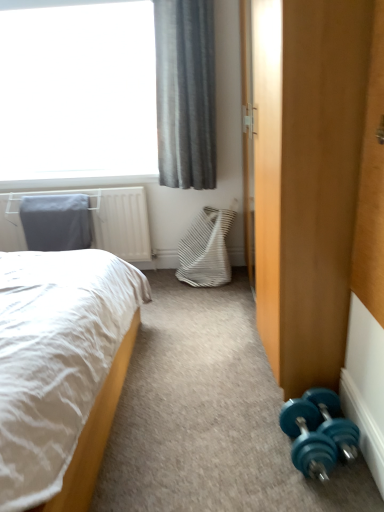
Question: Considering the relative positions of gray fabric curtain at upper left and teal rubber dumbbell at lower right, arranged as the first dumbbell when viewed from the right, in the image provided, is gray fabric curtain at upper left to the right of teal rubber dumbbell at lower right, arranged as the first dumbbell when viewed from the right, from the viewer's perspective?

Choices:
 (A) no
 (B) yes

Answer: (A)

Question: From a real-world perspective, does gray fabric curtain at upper left stand above teal rubber dumbbell at lower right, arranged as the first dumbbell when viewed from the right?

Choices:
 (A) yes
 (B) no

Answer: (A)

Question: From the image's perspective, is gray fabric curtain at upper left above teal rubber dumbbell at lower right, arranged as the first dumbbell when viewed from the right?

Choices:
 (A) yes
 (B) no

Answer: (A)

Question: Does gray fabric curtain at upper left have a smaller size compared to teal rubber dumbbell at lower right, arranged as the first dumbbell when viewed from the right?

Choices:
 (A) no
 (B) yes

Answer: (A)

Question: Considering the relative sizes of gray fabric curtain at upper left and teal rubber dumbbell at lower right, arranged as the first dumbbell when viewed from the right, in the image provided, is gray fabric curtain at upper left thinner than teal rubber dumbbell at lower right, arranged as the first dumbbell when viewed from the right,?

Choices:
 (A) yes
 (B) no

Answer: (B)

Question: From the image's perspective, is gray fabric pillow at upper left located above or below teal rubber dumbbell at lower right, arranged as the first dumbbell when viewed from the right?

Choices:
 (A) below
 (B) above

Answer: (B)

Question: Is gray fabric pillow at upper left taller or shorter than teal rubber dumbbell at lower right, which appears as the second dumbbell when viewed from the left?

Choices:
 (A) tall
 (B) short

Answer: (A)

Question: Do you think gray fabric pillow at upper left is within teal rubber dumbbell at lower right, arranged as the first dumbbell when viewed from the right, or outside of it?

Choices:
 (A) inside
 (B) outside

Answer: (B)

Question: Considering the positions of gray fabric pillow at upper left and teal rubber dumbbell at lower right, arranged as the first dumbbell when viewed from the right, in the image, is gray fabric pillow at upper left bigger or smaller than teal rubber dumbbell at lower right, arranged as the first dumbbell when viewed from the right,?

Choices:
 (A) small
 (B) big

Answer: (B)

Question: In terms of height, does gray fabric pillow at upper left look taller or shorter compared to white soft bed at left?

Choices:
 (A) tall
 (B) short

Answer: (B)

Question: Considering the relative positions of gray fabric pillow at upper left and white soft bed at left in the image provided, is gray fabric pillow at upper left to the left or to the right of white soft bed at left?

Choices:
 (A) right
 (B) left

Answer: (B)

Question: Considering the positions of gray fabric pillow at upper left and white soft bed at left in the image, is gray fabric pillow at upper left wider or thinner than white soft bed at left?

Choices:
 (A) thin
 (B) wide

Answer: (A)

Question: From a real-world perspective, is gray fabric pillow at upper left above or below white soft bed at left?

Choices:
 (A) above
 (B) below

Answer: (A)

Question: In terms of height, does teal rubber dumbbell at lower right, the second dumbbell positioned from the right, look taller or shorter compared to white soft bed at left?

Choices:
 (A) tall
 (B) short

Answer: (B)

Question: Is point (319, 438) positioned closer to the camera than point (44, 483)?

Choices:
 (A) farther
 (B) closer

Answer: (A)